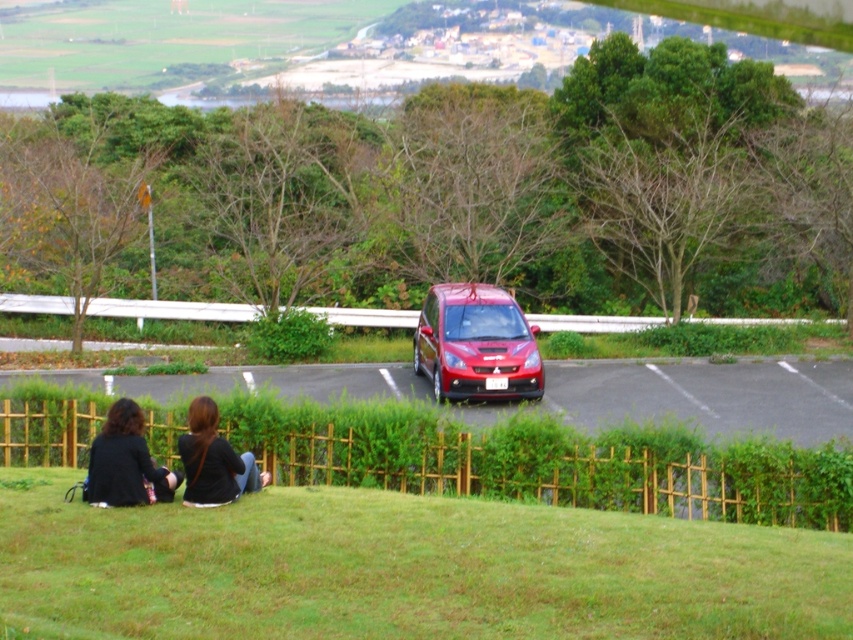
Question: Which of these objects is positioned farthest from the glossy red car at center?

Choices:
 (A) green grassy hillside at lower center
 (B) green bamboo fence at lower center
 (C) black fabric jacket at lower left
 (D) green leafy hedge at center

Answer: (A)

Question: Can you confirm if green leafy hedge at center is bigger than black fabric jacket at lower left?

Choices:
 (A) no
 (B) yes

Answer: (B)

Question: Does green leafy hedge at center appear under black fabric shirt at lower left?

Choices:
 (A) yes
 (B) no

Answer: (B)

Question: Among these objects, which one is nearest to the camera?

Choices:
 (A) green leafy hedge at center
 (B) glossy red car at center
 (C) green bamboo fence at lower center
 (D) black fabric shirt at lower left

Answer: (D)

Question: Among these points, which one is nearest to the camera?

Choices:
 (A) (111, 428)
 (B) (439, 468)
 (C) (508, 301)

Answer: (A)

Question: Is green leafy hedge at center wider than green bamboo fence at lower center?

Choices:
 (A) yes
 (B) no

Answer: (A)